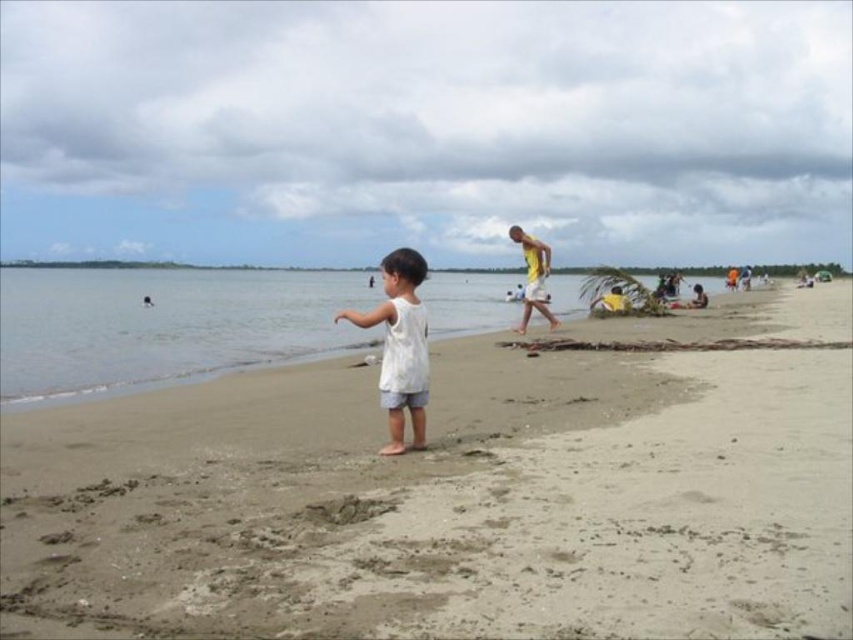
Can you confirm if light brown sand at center is wider than clear water at lower left?

No.

Is point (809, 355) positioned before point (207, 333)?

That is True.

Is point (368, 460) positioned before point (108, 276)?

Yes, it is.

Find the location of a particular element. light brown sand at center is located at coordinates (442, 500).

Can you confirm if clear water at lower left is wider than yellow fabric shirt at center-right?

Correct, the width of clear water at lower left exceeds that of yellow fabric shirt at center-right.

Which is above, clear water at lower left or yellow fabric shirt at center-right?

Positioned higher is clear water at lower left.

Is point (283, 285) farther from camera compared to point (543, 252)?

Yes.

Locate an element on the screen. This screenshot has height=640, width=853. clear water at lower left is located at coordinates (165, 324).

Does white cotton shirt at center appear on the left side of yellow fabric shirt at center-right?

Correct, you'll find white cotton shirt at center to the left of yellow fabric shirt at center-right.

Image resolution: width=853 pixels, height=640 pixels. What do you see at coordinates (399, 346) in the screenshot?
I see `white cotton shirt at center` at bounding box center [399, 346].

Which is in front, point (380, 305) or point (518, 326)?

Positioned in front is point (380, 305).

This screenshot has height=640, width=853. In order to click on white cotton shirt at center in this screenshot , I will do `click(399, 346)`.